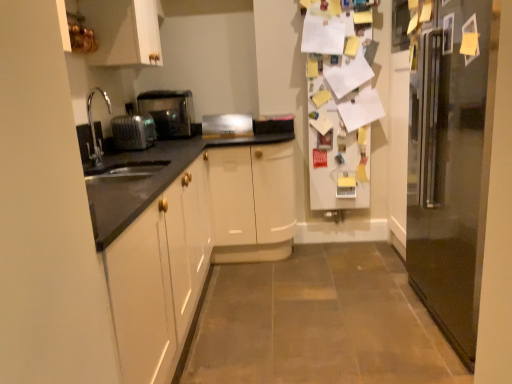
Question: In the image, is satin silver toaster at left positioned in front of or behind satin silver toaster at left, which is the 2th appliance in right-to-left order?

Choices:
 (A) behind
 (B) front

Answer: (A)

Question: From a real-world perspective, is satin silver toaster at left positioned above or below satin silver toaster at left, which is the 1th appliance in left-to-right order?

Choices:
 (A) below
 (B) above

Answer: (B)

Question: Which object is positioned farthest from the white glossy cabinet at upper left?

Choices:
 (A) metallic stainless steel refrigerator at right
 (B) satin silver toaster at left
 (C) satin silver toaster at left, which is the 2th appliance in right-to-left order
 (D) satin silver toaster at center, placed as the first appliance when sorted from right to left

Answer: (A)

Question: Considering the real-world distances, which object is farthest from the metallic stainless steel refrigerator at right?

Choices:
 (A) satin silver toaster at center, placed as the first appliance when sorted from right to left
 (B) satin silver toaster at left
 (C) white glossy cabinet at upper left
 (D) satin silver toaster at left, which is the 1th appliance in left-to-right order

Answer: (B)